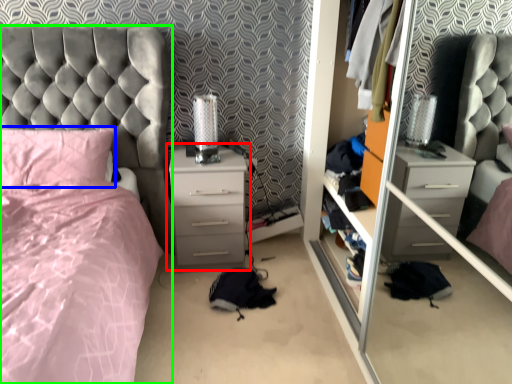
Question: Based on their relative distances, which object is farther from chest of drawers (highlighted by a red box)? Choose from pillow (highlighted by a blue box) and bed (highlighted by a green box).

Choices:
 (A) pillow
 (B) bed

Answer: (A)